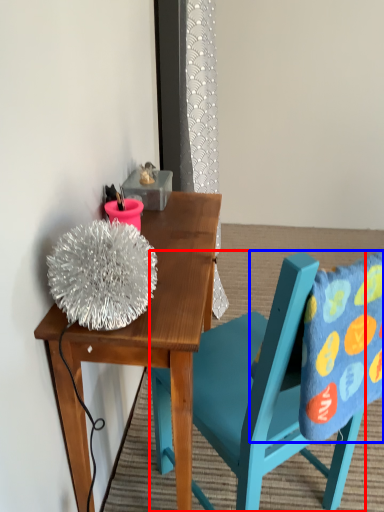
Question: Which object is further to the camera taking this photo, chair (highlighted by a red box) or pillow (highlighted by a blue box)?

Choices:
 (A) chair
 (B) pillow

Answer: (B)